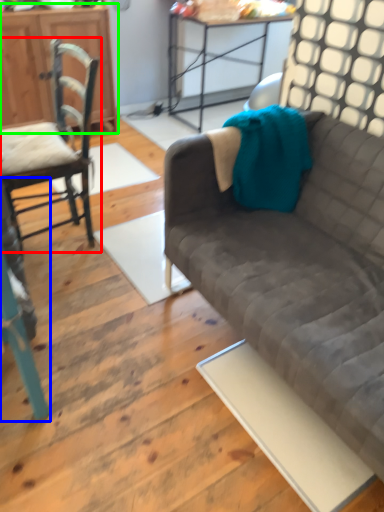
Question: Estimate the real-world distances between objects in this image. Which object is farther from chair (highlighted by a red box), chair (highlighted by a blue box) or cabinetry (highlighted by a green box)?

Choices:
 (A) chair
 (B) cabinetry

Answer: (B)